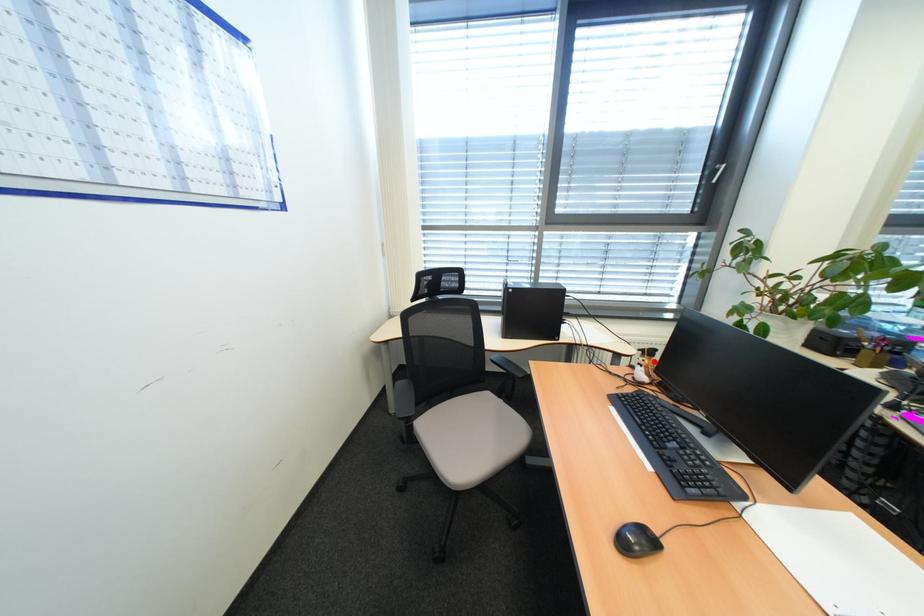
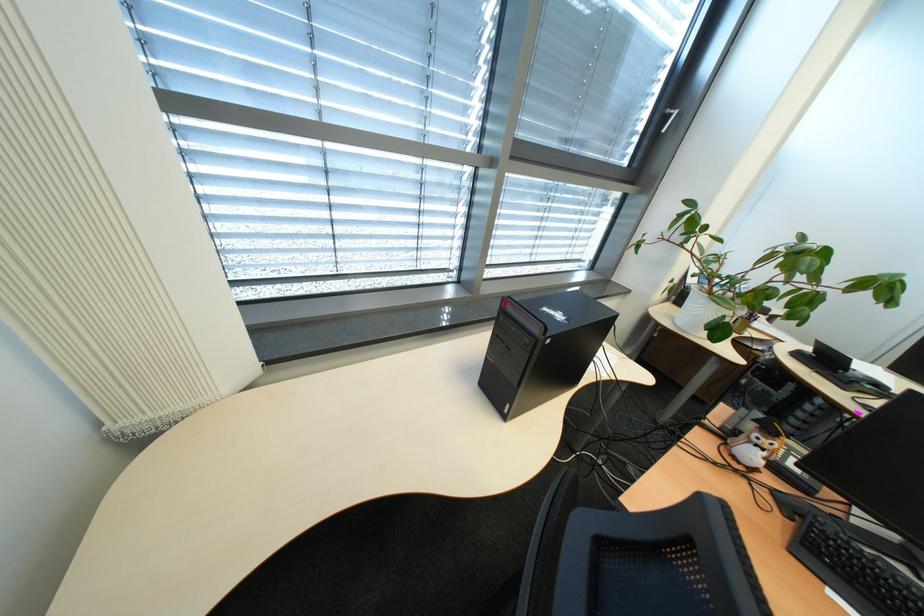
Question: I am providing you with two images of the same scene from different viewpoints. A red point is shown in image1. For the corresponding object point in image2, is it positioned nearer or farther from the camera?

Choices:
 (A) Nearer
 (B) Farther

Answer: (B)